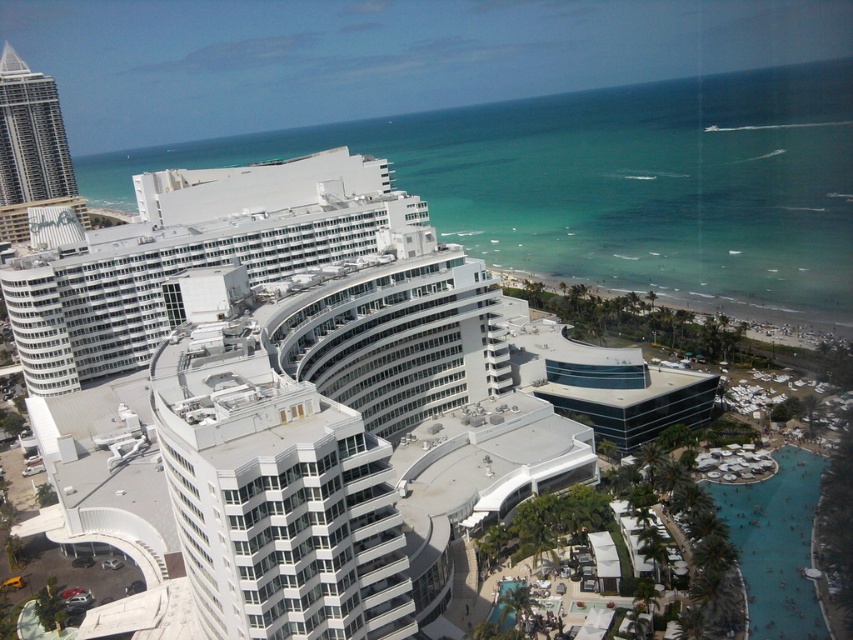
Can you confirm if white glass building at center is positioned to the right of matte white skyscraper at left?

Indeed, white glass building at center is positioned on the right side of matte white skyscraper at left.

Identify the location of white glass building at center. click(x=306, y=401).